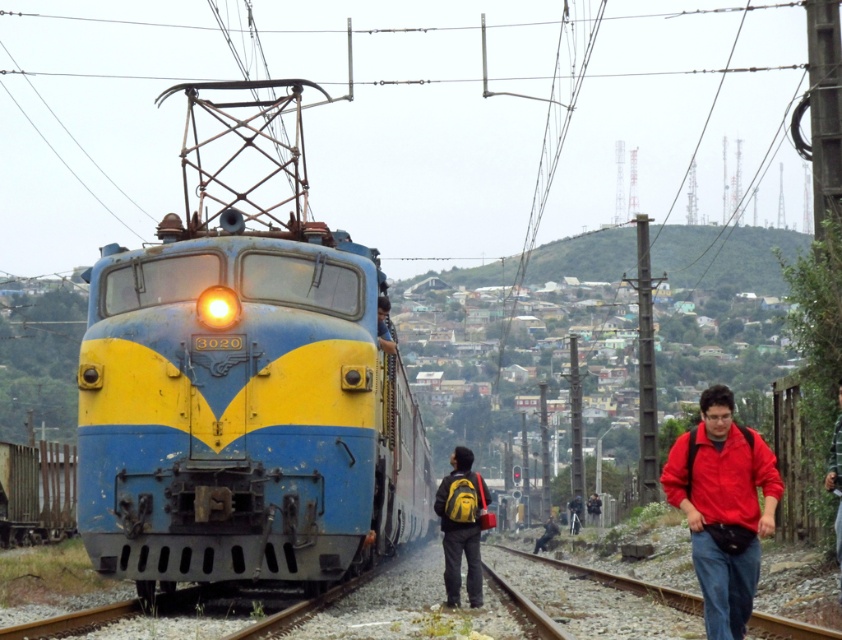
Question: Can you confirm if blue/yellow painted locomotive at center is smaller than blue fabric jacket at center?

Choices:
 (A) yes
 (B) no

Answer: (B)

Question: Which point is closer to the camera taking this photo?

Choices:
 (A) (382, 317)
 (B) (446, 528)
 (C) (750, 490)

Answer: (C)

Question: Which point appears closest to the camera in this image?

Choices:
 (A) (385, 298)
 (B) (449, 600)
 (C) (125, 284)

Answer: (C)

Question: Can you confirm if red matte jacket at lower right is positioned above red jacket at lower right?

Choices:
 (A) yes
 (B) no

Answer: (B)

Question: Which object appears farthest from the camera in this image?

Choices:
 (A) blue fabric jacket at center
 (B) yellow backpack at center

Answer: (A)

Question: Is blue/yellow painted locomotive at center to the right of blue fabric jacket at center from the viewer's perspective?

Choices:
 (A) yes
 (B) no

Answer: (B)